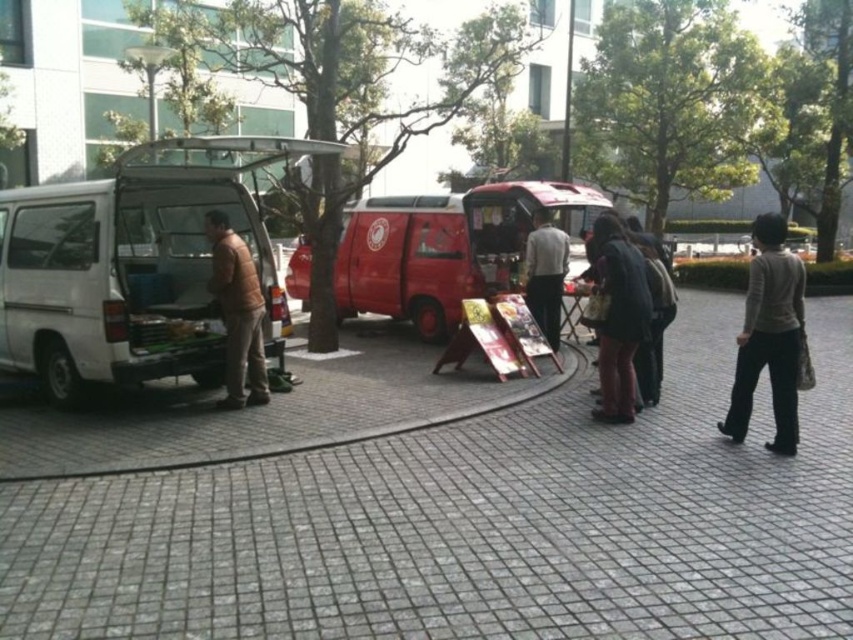
Question: Does gray brick pavement at center have a smaller size compared to brown quilted vest at left?

Choices:
 (A) yes
 (B) no

Answer: (A)

Question: Can you confirm if light gray sweater at right is positioned above brown quilted vest at left?

Choices:
 (A) no
 (B) yes

Answer: (B)

Question: Which of the following is the closest to the observer?

Choices:
 (A) light gray sweater at right
 (B) brown quilted vest at left

Answer: (A)

Question: Which of the following is the closest to the observer?

Choices:
 (A) (618, 216)
 (B) (762, 337)
 (C) (53, 540)

Answer: (C)

Question: Which of these objects is positioned closest to the light gray sweater at right?

Choices:
 (A) brown quilted vest at left
 (B) dark brown leather jacket at center
 (C) white matte van at left
 (D) light gray sweater at center

Answer: (B)

Question: Can you confirm if gray brick pavement at center is bigger than shiny red van at center?

Choices:
 (A) no
 (B) yes

Answer: (A)